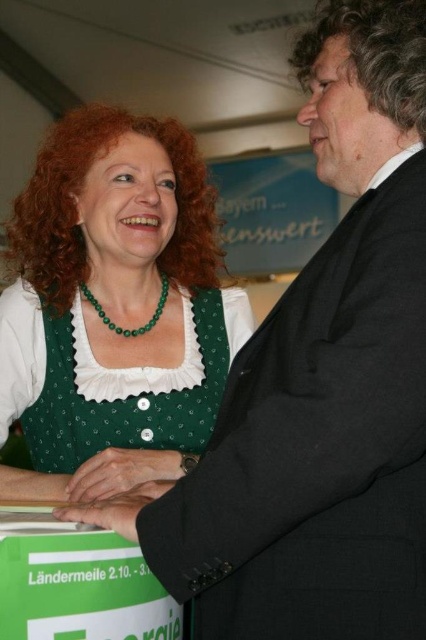
Between point (126, 577) and point (126, 525), which one is positioned in front?

Point (126, 525)

Which is behind, point (149, 582) or point (80, 513)?

Point (80, 513)

Where is `green cardboard box at lower left`? This screenshot has height=640, width=426. green cardboard box at lower left is located at coordinates (77, 582).

Which is below, green fabric hand at center or smooth black hand at center?

Positioned lower is green fabric hand at center.

Between point (152, 449) and point (117, 512), which one is positioned in front?

Point (117, 512) is in front.

What do you see at coordinates (120, 472) in the screenshot? Image resolution: width=426 pixels, height=640 pixels. I see `green fabric hand at center` at bounding box center [120, 472].

Locate an element on the screen. green fabric hand at center is located at coordinates (120, 472).

Is green fabric dress at center below smooth black hand at center?

No.

Between green fabric dress at center and smooth black hand at center, which one has less height?

smooth black hand at center is shorter.

The image size is (426, 640). Describe the element at coordinates (112, 308) in the screenshot. I see `green fabric dress at center` at that location.

Locate an element on the screen. green fabric dress at center is located at coordinates (112, 308).